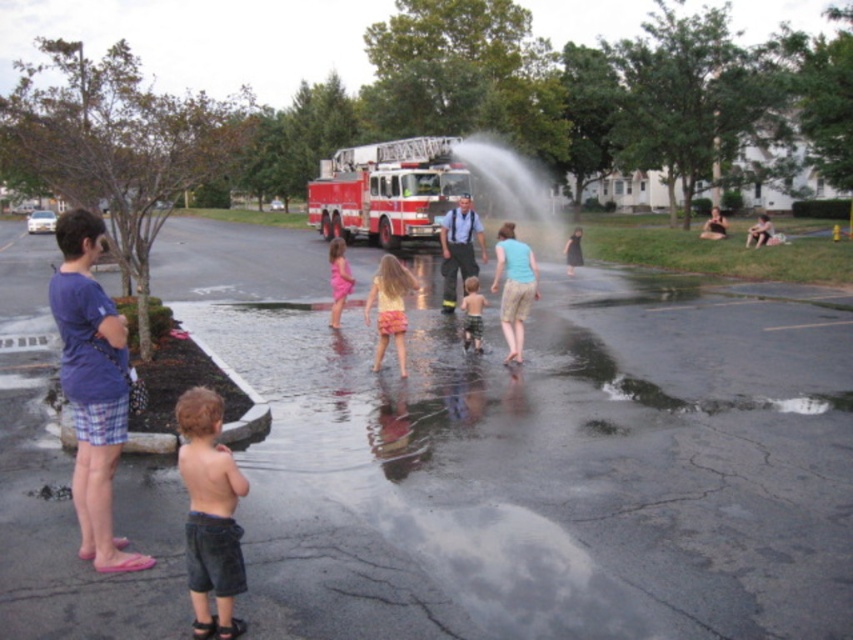
Question: Which point is farther from the camera taking this photo?

Choices:
 (A) (233, 468)
 (B) (364, 173)
 (C) (579, 243)

Answer: (B)

Question: Is clear water at center bigger than pink fabric dress at center?

Choices:
 (A) no
 (B) yes

Answer: (A)

Question: Considering the relative positions of clear water at center and light blue cotton shirt at center in the image provided, where is clear water at center located with respect to light blue cotton shirt at center?

Choices:
 (A) left
 (B) right

Answer: (A)

Question: Which of the following is the farthest from the observer?

Choices:
 (A) light blue cotton shirt at center
 (B) matte pink dress at center
 (C) blue uniform at center
 (D) denim shorts at lower left

Answer: (B)

Question: Based on their relative distances, which object is farther from the matte pink dress at center?

Choices:
 (A) pink fabric dress at center
 (B) green plaid shorts at center
 (C) red glossy fire truck at center
 (D) clear water at center

Answer: (D)

Question: Does red glossy fire truck at center appear on the right side of matte pink dress at center?

Choices:
 (A) yes
 (B) no

Answer: (B)